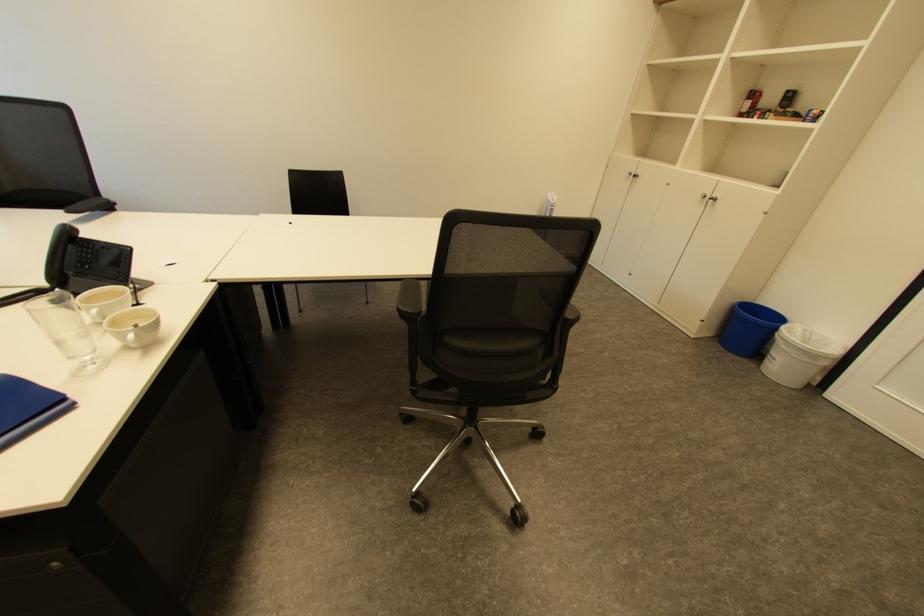
Which object does [66,331] point to?

This point indicates the clear water bottle.